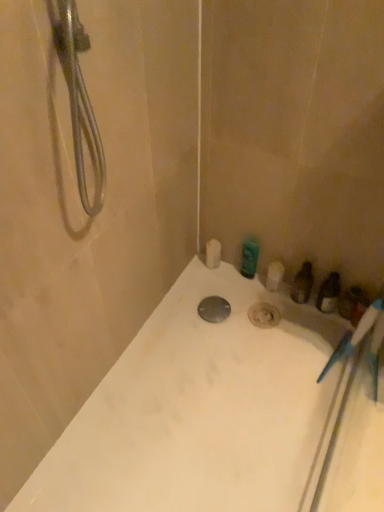
Locate an element on the screen. Image resolution: width=384 pixels, height=512 pixels. free space in front of translucent plastic bottle at right, which ranks as the 1th toiletry in right-to-left order is located at coordinates (339, 357).